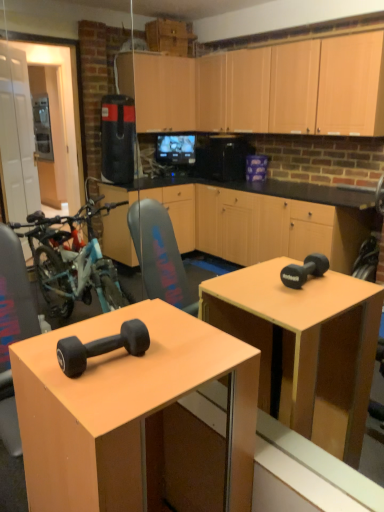
At what (x,y) coordinates should I click in order to perform the action: click on matte black dumbbell at center. Please return your answer as a coordinate pair (x, y). The height and width of the screenshot is (512, 384). Looking at the image, I should click on (126, 409).

The width and height of the screenshot is (384, 512). What do you see at coordinates (126, 409) in the screenshot?
I see `matte black dumbbell at center` at bounding box center [126, 409].

What do you see at coordinates (101, 347) in the screenshot? I see `black rubber dumbbell at lower left` at bounding box center [101, 347].

The image size is (384, 512). In order to click on black rubber dumbbell at lower left in this screenshot , I will do `click(101, 347)`.

Image resolution: width=384 pixels, height=512 pixels. I want to click on matte black dumbbell at center, so click(126, 409).

Considering the relative positions of black rubber dumbbell at lower left and matte black dumbbell at center in the image provided, is black rubber dumbbell at lower left to the left of matte black dumbbell at center from the viewer's perspective?

Indeed, black rubber dumbbell at lower left is positioned on the left side of matte black dumbbell at center.

Which is in front, black rubber dumbbell at lower left or matte black dumbbell at center?

Positioned in front is matte black dumbbell at center.

Does point (136, 329) come farther from viewer compared to point (87, 473)?

Yes, point (136, 329) is farther from viewer.

From the image's perspective, which is below, black rubber dumbbell at lower left or matte black dumbbell at center?

matte black dumbbell at center.

In the scene shown: From a real-world perspective, is black rubber dumbbell at lower left on matte black dumbbell at center?

Yes, from a real-world perspective, black rubber dumbbell at lower left is over matte black dumbbell at center

Which object is wider, black rubber dumbbell at lower left or matte black dumbbell at center?

matte black dumbbell at center is wider.

Is black rubber dumbbell at lower left taller than matte black dumbbell at center?

No.

Is black rubber dumbbell at lower left smaller than matte black dumbbell at center?

Yes, black rubber dumbbell at lower left is smaller than matte black dumbbell at center.

Is black rubber dumbbell at lower left completely or partially outside of matte black dumbbell at center?

black rubber dumbbell at lower left lies outside matte black dumbbell at center's area.

Is there a large distance between black rubber dumbbell at lower left and matte black dumbbell at center?

No.

Is black rubber dumbbell at lower left aimed at matte black dumbbell at center?

No, black rubber dumbbell at lower left is not turned towards matte black dumbbell at center.

Locate an element on the screen. dumbbell above the matte black dumbbell at center (from the image's perspective) is located at coordinates (101, 347).

Can you confirm if matte black dumbbell at center is positioned to the left of black rubber dumbbell at lower left?

No, matte black dumbbell at center is not to the left of black rubber dumbbell at lower left.

Relative to black rubber dumbbell at lower left, is matte black dumbbell at center in front or behind?

matte black dumbbell at center is in front of black rubber dumbbell at lower left.

Considering the positions of point (141, 470) and point (73, 369), is point (141, 470) closer or farther from the camera than point (73, 369)?

Point (141, 470) is closer to the camera than point (73, 369).

From the image's perspective, is matte black dumbbell at center above black rubber dumbbell at lower left?

No.

From a real-world perspective, which object rests below the other?

From a 3D spatial view, matte black dumbbell at center is below.

Is matte black dumbbell at center thinner than black rubber dumbbell at lower left?

No, matte black dumbbell at center is not thinner than black rubber dumbbell at lower left.

Considering the sizes of objects matte black dumbbell at center and black rubber dumbbell at lower left in the image provided, who is taller, matte black dumbbell at center or black rubber dumbbell at lower left?

With more height is matte black dumbbell at center.

Can you confirm if matte black dumbbell at center is smaller than black rubber dumbbell at lower left?

Actually, matte black dumbbell at center might be larger than black rubber dumbbell at lower left.

Is matte black dumbbell at center inside the boundaries of black rubber dumbbell at lower left, or outside?

matte black dumbbell at center is not enclosed by black rubber dumbbell at lower left.

Would you consider matte black dumbbell at center to be distant from black rubber dumbbell at lower left?

No, there isn't a large distance between matte black dumbbell at center and black rubber dumbbell at lower left.

Does matte black dumbbell at center turn towards black rubber dumbbell at lower left?

No, matte black dumbbell at center is not turned towards black rubber dumbbell at lower left.

Consider the image. What's the angular difference between matte black dumbbell at center and black rubber dumbbell at lower left's facing directions?

The facing directions of matte black dumbbell at center and black rubber dumbbell at lower left are 1.64 degrees apart.

Find the location of a particular element. The width and height of the screenshot is (384, 512). desk lying below the black rubber dumbbell at lower left (from the image's perspective) is located at coordinates (126, 409).

The image size is (384, 512). I want to click on dumbbell on the left side of matte black dumbbell at center, so click(x=101, y=347).

In order to click on desk that appears in front of the black rubber dumbbell at lower left in this screenshot , I will do `click(126, 409)`.